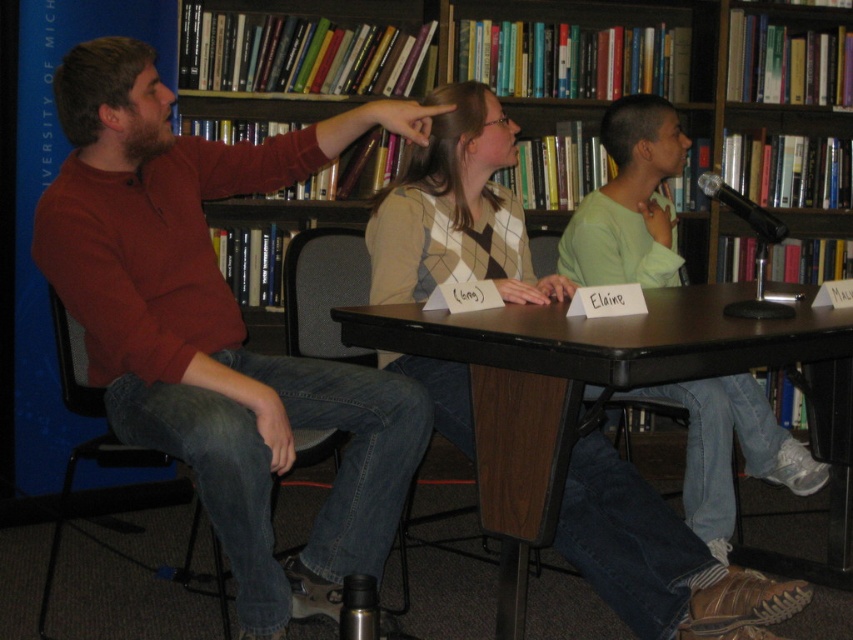
In the scene, there are two points marked as point 1 at coordinates (621, 326) and point 2 at coordinates (86, 392). From the perspective of someone sitting at the table, which point is closer to the observer?

Point 1 at coordinates (621, 326) is closer to the observer because it is in front of point 2 at coordinates (86, 392).